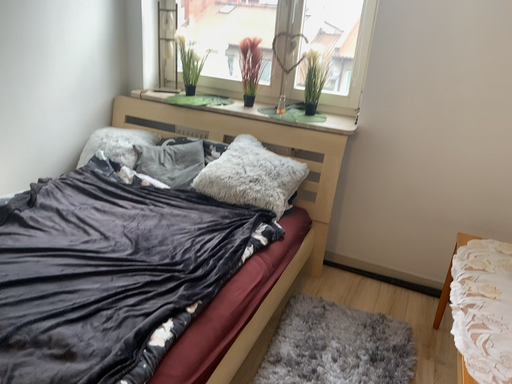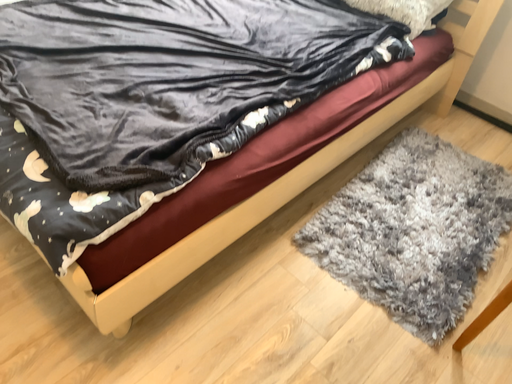
Question: Which way did the camera rotate in the video?

Choices:
 (A) rotated right
 (B) rotated left

Answer: (B)